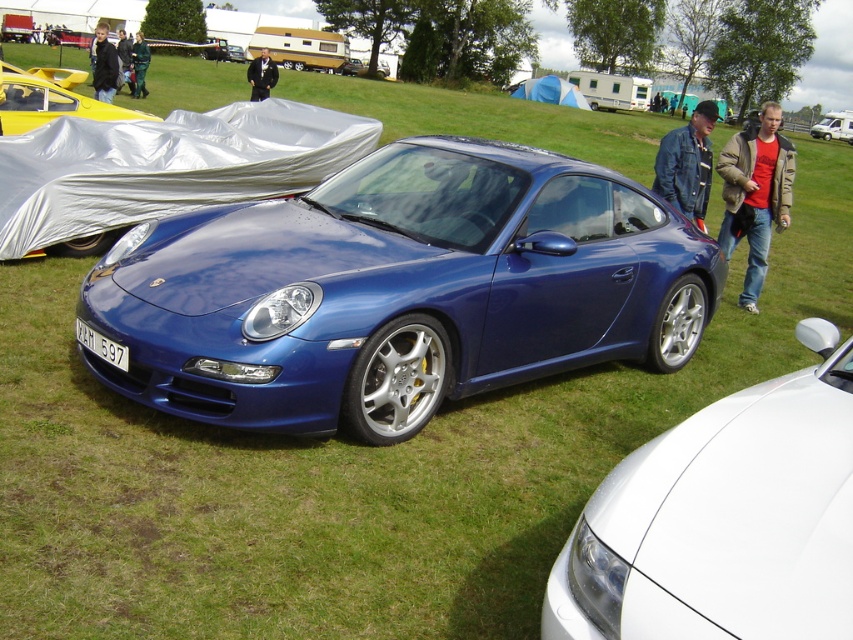
Question: Which point is closer to the camera?

Choices:
 (A) metallic silver car at center
 (B) green fabric jacket at upper left
 (C) denim jacket at upper right

Answer: (C)

Question: Where is denim jacket at upper right located in relation to metallic silver car at center in the image?

Choices:
 (A) left
 (B) right

Answer: (B)

Question: Which point is closer to the camera taking this photo?

Choices:
 (A) click(109, 44)
 (B) click(677, 196)
 (C) click(360, 60)
 (D) click(799, 401)

Answer: (D)

Question: Considering the real-world distances, which object is farthest from the metallic silver van at upper right?

Choices:
 (A) yellow matte sports car at upper left
 (B) black suit at center
 (C) green fabric jacket at upper left
 (D) silver plastic tarp at center

Answer: (A)

Question: Where is denim jacket at upper right located in relation to green fabric jacket at upper left in the image?

Choices:
 (A) above
 (B) below

Answer: (B)

Question: Does dark blue leather jacket at upper left appear under white plastic license plate at center?

Choices:
 (A) no
 (B) yes

Answer: (A)